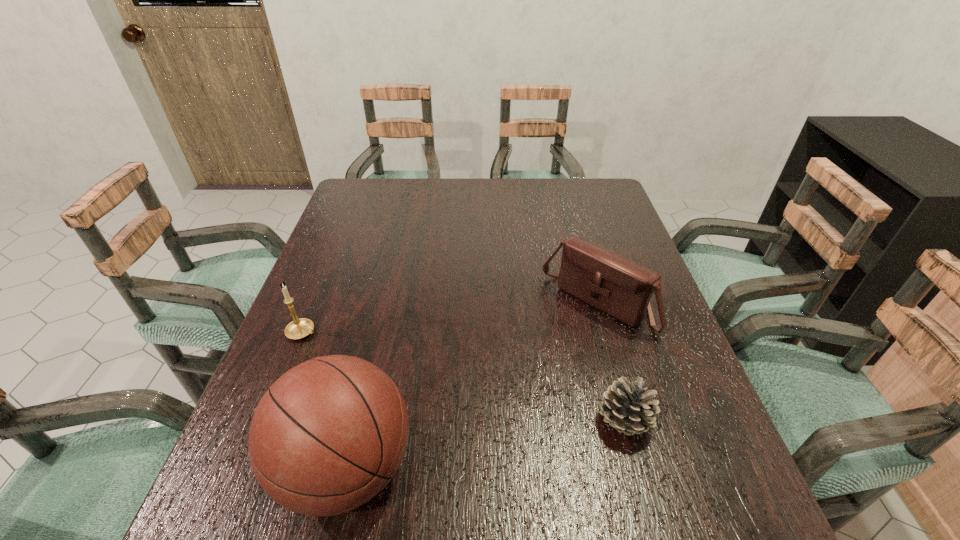
The image size is (960, 540). I want to click on object present at the near edge, so click(x=628, y=408).

Where is `object positioned at the left edge`? object positioned at the left edge is located at coordinates (299, 328).

You are a GUI agent. You are given a task and a screenshot of the screen. Output one action in this format:
    pyautogui.click(x=<x>, y=<y>)
    Task: Click on the pinecone present at the right edge
    
    Given the screenshot: What is the action you would take?
    pyautogui.click(x=628, y=408)

This screenshot has width=960, height=540. What are the coordinates of `shoulder bag that is at the right edge` in the screenshot? It's located at 615,285.

Identify the location of object that is positioned at the near right corner. (628, 408).

Identify the location of vacant space at the far edge of the desktop. The width and height of the screenshot is (960, 540). (544, 210).

In the image, there is a desktop. Where is `free space at the near edge`? The image size is (960, 540). free space at the near edge is located at coordinates pyautogui.click(x=507, y=448).

The height and width of the screenshot is (540, 960). In the image, there is a desktop. Find the location of `blank space at the left edge`. blank space at the left edge is located at coordinates (357, 244).

In the image, there is a desktop. Identify the location of vacant space at the right edge. (670, 425).

Locate an element on the screen. The width and height of the screenshot is (960, 540). vacant space at the far left corner is located at coordinates pos(361,206).